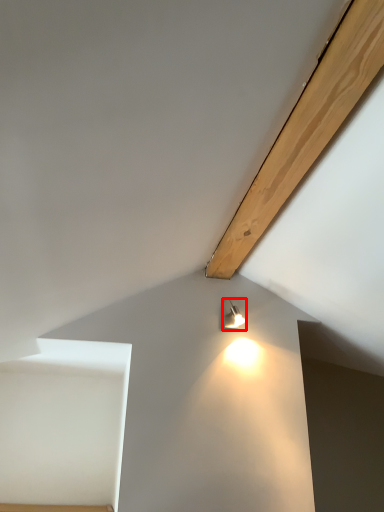
Question: From the image's perspective, considering the relative positions of lamp (annotated by the red box) and plywood in the image provided, where is lamp (annotated by the red box) located with respect to the staircase?

Choices:
 (A) below
 (B) above

Answer: (A)